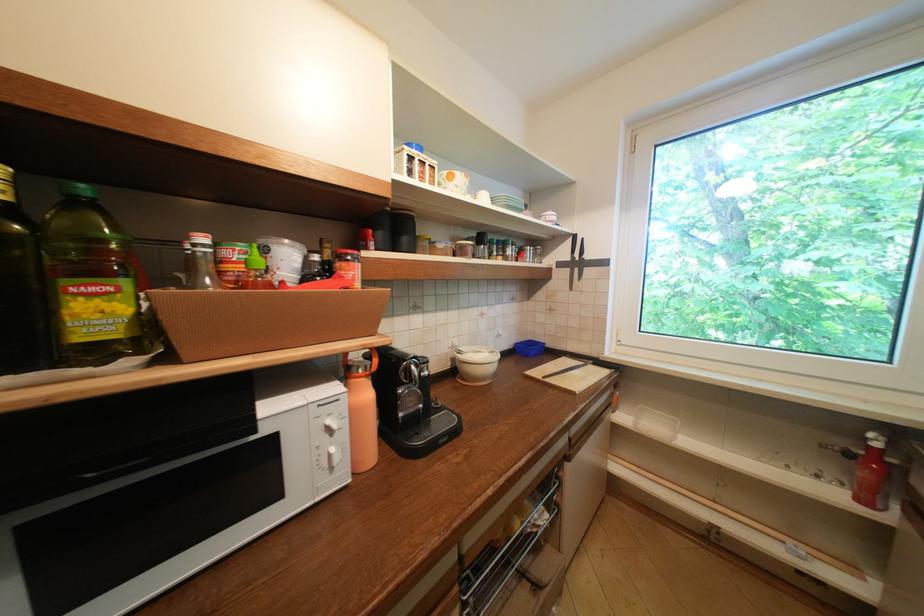
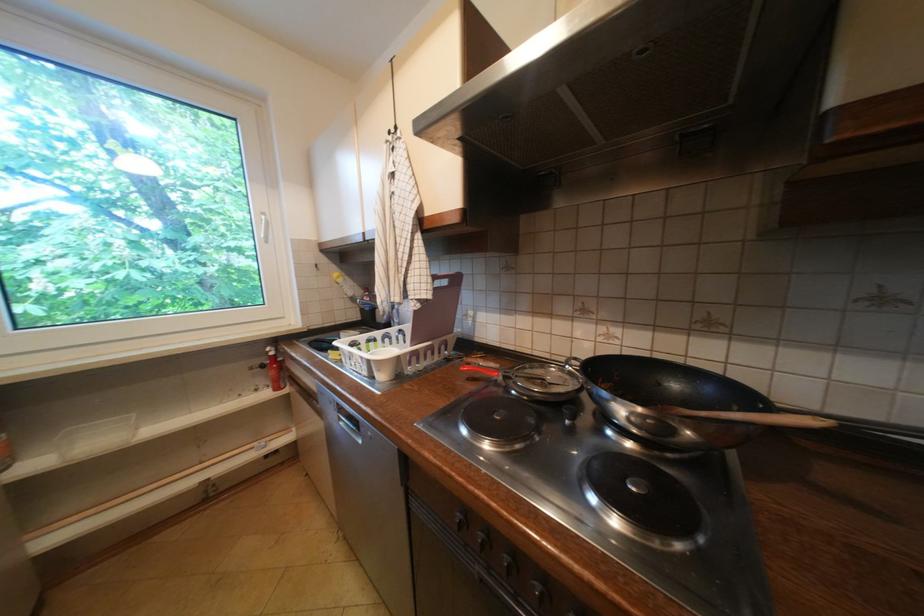
Question: The first image is from the beginning of the video and the second image is from the end. How did the camera likely rotate when shooting the video?

Choices:
 (A) Left
 (B) Right
 (C) Up
 (D) Down

Answer: (B)